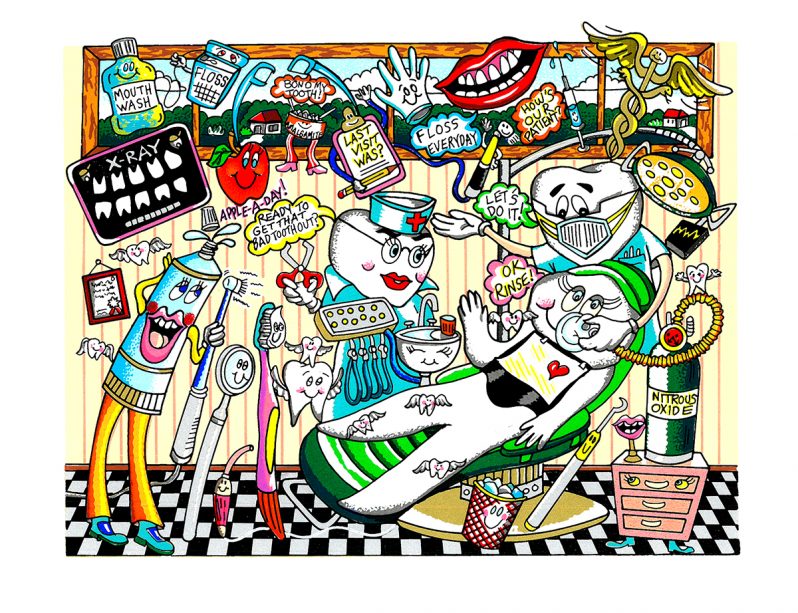
This screenshot has height=613, width=798. Identify the location of black and white floor. (338, 539).